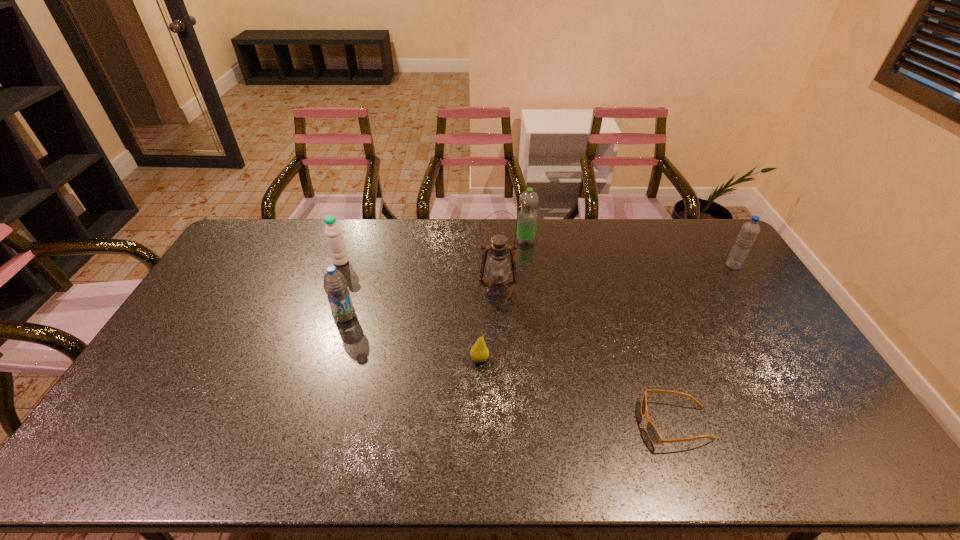
At what (x,y) coordinates should I click in order to perform the action: click on the fourth farthest object. Please return your answer as a coordinate pair (x, y). This screenshot has width=960, height=540. Looking at the image, I should click on (497, 289).

The height and width of the screenshot is (540, 960). I want to click on the tallest object, so click(497, 289).

Locate an element on the screen. The height and width of the screenshot is (540, 960). the farthest water bottle is located at coordinates (527, 217).

Locate an element on the screen. Image resolution: width=960 pixels, height=540 pixels. the second water bottle from right to left is located at coordinates (527, 217).

Where is `the rightmost water bottle`? the rightmost water bottle is located at coordinates (750, 230).

Find the location of a particular element. The width and height of the screenshot is (960, 540). the nearest water bottle is located at coordinates (335, 285).

At what (x,y) coordinates should I click in order to perform the action: click on the sixth object from right to left. Please return your answer as a coordinate pair (x, y). Looking at the image, I should click on (335, 285).

Where is `the leftmost water bottle`? This screenshot has height=540, width=960. the leftmost water bottle is located at coordinates (333, 233).

Locate an element on the screen. the second shortest object is located at coordinates (479, 352).

The image size is (960, 540). What are the coordinates of `the second nearest object` in the screenshot? It's located at (479, 352).